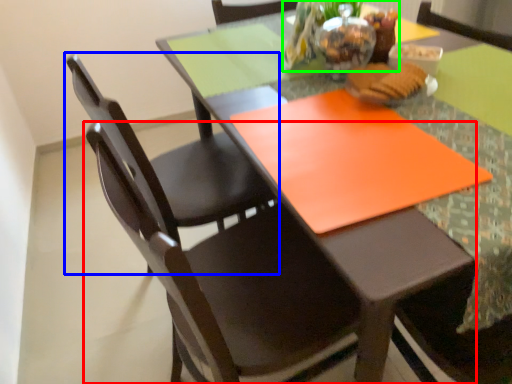
Question: Based on their relative distances, which object is farther from chair (highlighted by a red box)? Choose from chair (highlighted by a blue box) and floral arrangement (highlighted by a green box).

Choices:
 (A) chair
 (B) floral arrangement

Answer: (B)